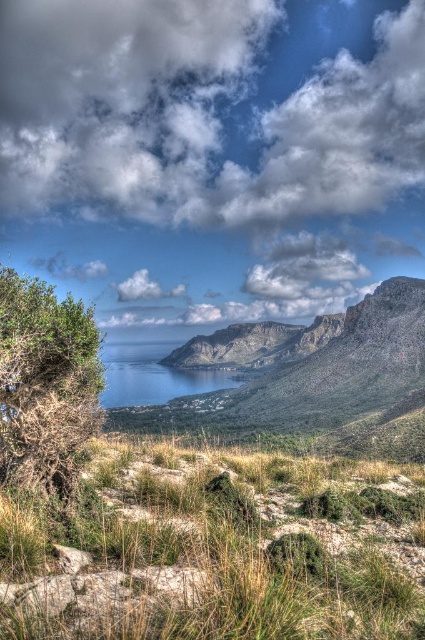
Between green grassy at lower center and green leafy bush at left, which one appears on the left side from the viewer's perspective?

green leafy bush at left

Which is in front, point (198, 513) or point (5, 278)?

Positioned in front is point (198, 513).

You are a GUI agent. You are given a task and a screenshot of the screen. Output one action in this format:
    pyautogui.click(x=<x>, y=<y>)
    Task: Click on the green grassy at lower center
    The height and width of the screenshot is (640, 425).
    Given the screenshot: What is the action you would take?
    pyautogui.click(x=215, y=548)

Which is above, cloudy sky at upper center or green grassy at lower center?

cloudy sky at upper center

How far apart are cloudy sky at upper center and green grassy at lower center?

The distance of cloudy sky at upper center from green grassy at lower center is 682.24 meters.

This screenshot has width=425, height=640. Identify the location of cloudy sky at upper center. (212, 148).

Is point (138, 480) closer to camera compared to point (133, 340)?

Yes, it is in front of point (133, 340).

Can you confirm if green grassy at lower center is positioned to the left of blue water at center?

In fact, green grassy at lower center is to the right of blue water at center.

The width and height of the screenshot is (425, 640). What do you see at coordinates (215, 548) in the screenshot? I see `green grassy at lower center` at bounding box center [215, 548].

You are a GUI agent. You are given a task and a screenshot of the screen. Output one action in this format:
    pyautogui.click(x=<x>, y=<y>)
    Task: Click on the green grassy at lower center
    The image size is (425, 640).
    Given the screenshot: What is the action you would take?
    pos(215,548)